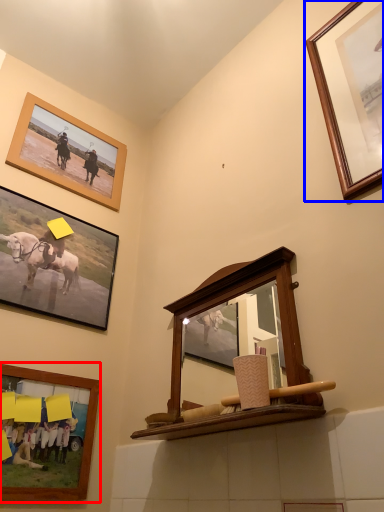
Question: Among these objects, which one is nearest to the camera, picture frame (highlighted by a red box) or picture frame (highlighted by a blue box)?

Choices:
 (A) picture frame
 (B) picture frame

Answer: (B)